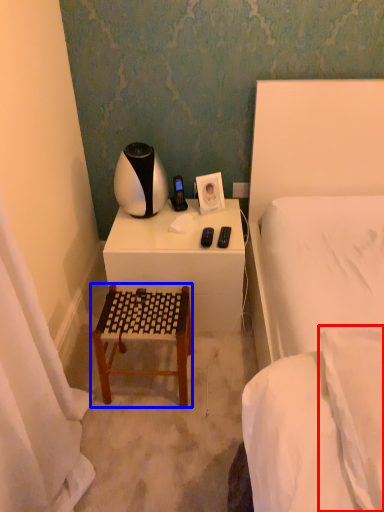
Question: Which point is further to the camera, pillow (highlighted by a red box) or furniture (highlighted by a blue box)?

Choices:
 (A) pillow
 (B) furniture

Answer: (B)